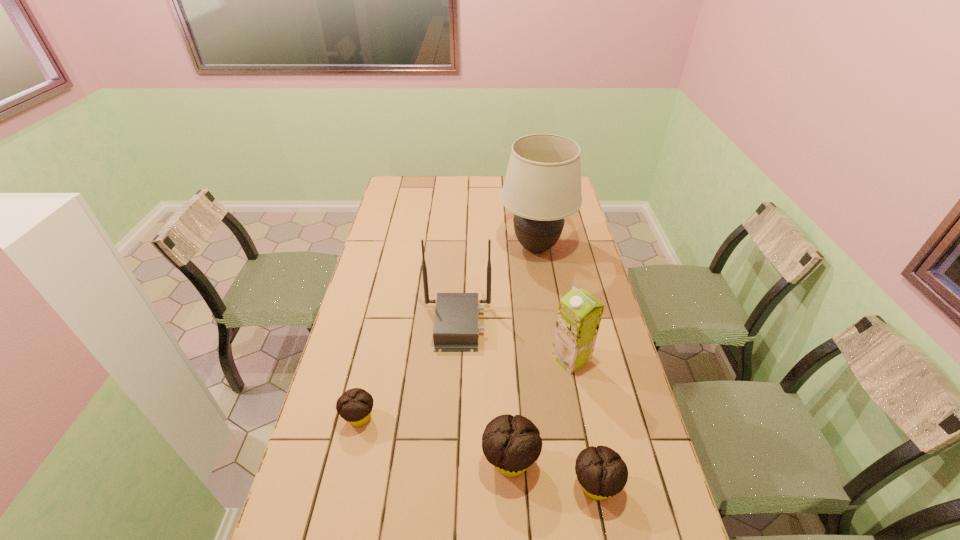
Identify the location of the fourth farthest object. (355, 406).

This screenshot has width=960, height=540. I want to click on the leftmost object, so click(355, 406).

Locate an element on the screen. the third shortest object is located at coordinates (512, 444).

The image size is (960, 540). I want to click on the tallest muffin, so click(x=512, y=444).

What are the coordinates of `the second tallest muffin` in the screenshot? It's located at (602, 473).

The image size is (960, 540). What are the coordinates of `the rightmost muffin` in the screenshot? It's located at pos(602,473).

Identify the location of router. This screenshot has height=540, width=960. (456, 328).

Find the location of a particular element. Image resolution: width=960 pixels, height=540 pixels. the tallest object is located at coordinates (542, 186).

This screenshot has width=960, height=540. Find the location of `the farthest object`. the farthest object is located at coordinates (542, 186).

Where is `soya milk`? The image size is (960, 540). soya milk is located at coordinates (579, 315).